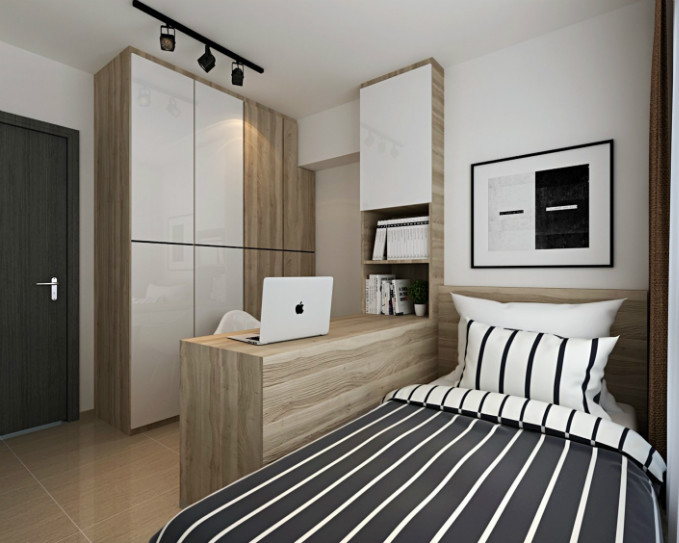
You are a GUI agent. You are given a task and a screenshot of the screen. Output one action in this format:
    pyautogui.click(x=<x>, y=<y>)
    Task: Click on the pillows
    
    Given the screenshot: What is the action you would take?
    pyautogui.click(x=543, y=320), pyautogui.click(x=542, y=355)